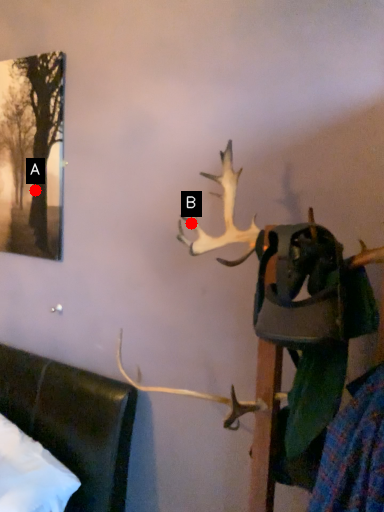
Question: Two points are circled on the image, labeled by A and B beside each circle. Which point is closer to the camera?

Choices:
 (A) A is closer
 (B) B is closer

Answer: (B)